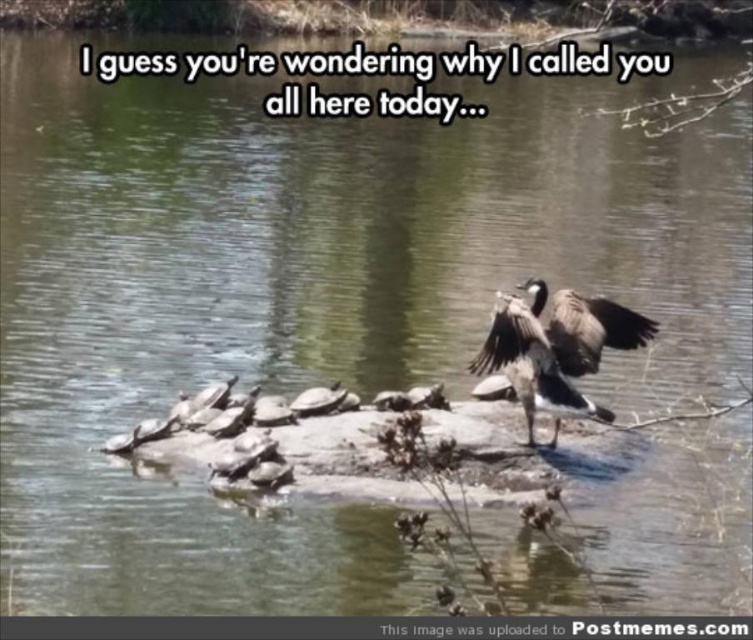
You are a photographer trying to capture a closeup of the gray feathered goose at center and the matte gray wing at upper right. Which one would you need to zoom in more on to fill the frame?

The matte gray wing at upper right is smaller than the gray feathered goose at center, so you would need to zoom in more on the matte gray wing at upper right to fill the frame.

You are standing at the point marked by the coordinates point (556, 348) in the scene. What object are you currently standing on?

You are standing on the gray feathered goose at center.